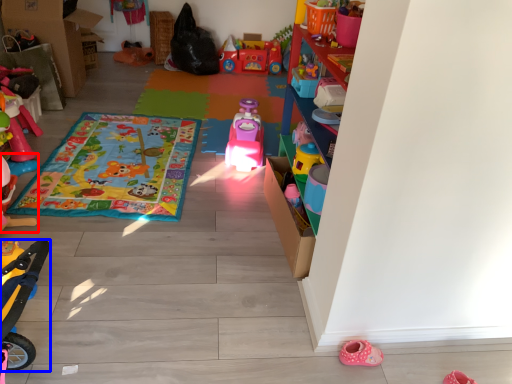
Question: Which of the following is the farthest to the observer, toy (highlighted by a red box) or toy (highlighted by a blue box)?

Choices:
 (A) toy
 (B) toy

Answer: (A)